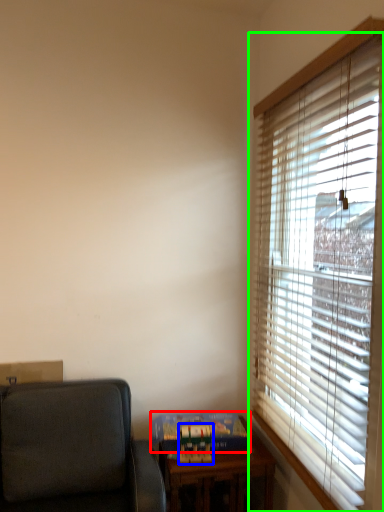
Question: Which object is the closest to the paperback book (highlighted by a red box)? Choose among these: paperback book (highlighted by a blue box) or window blind (highlighted by a green box).

Choices:
 (A) paperback book
 (B) window blind

Answer: (A)